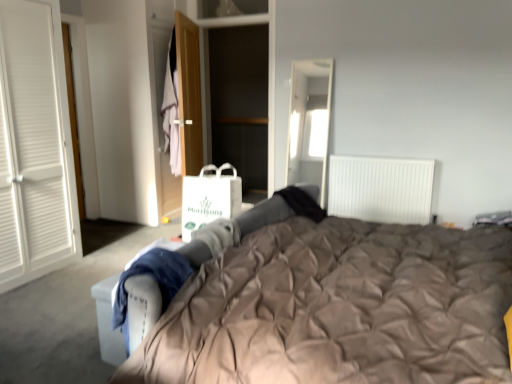
Question: From a real-world perspective, relative to light pink fabric at center, is wooden door at center vertically above or below?

Choices:
 (A) below
 (B) above

Answer: (A)

Question: Based on their positions, is wooden door at center located to the left or right of light pink fabric at center?

Choices:
 (A) left
 (B) right

Answer: (B)

Question: Estimate the real-world distances between objects in this image. Which object is closer to the white paper shopping bag at center?

Choices:
 (A) wooden door at center
 (B) light pink fabric at center
 (C) white plastic radiator at upper right
 (D) matte brown duvet at center
 (E) dark wood cabinet at center

Answer: (D)

Question: Estimate the real-world distances between objects in this image. Which object is closer to the light pink fabric at center?

Choices:
 (A) dark wood cabinet at center
 (B) matte brown duvet at center
 (C) wooden door at center
 (D) white paper shopping bag at center
 (E) white plastic radiator at upper right

Answer: (C)